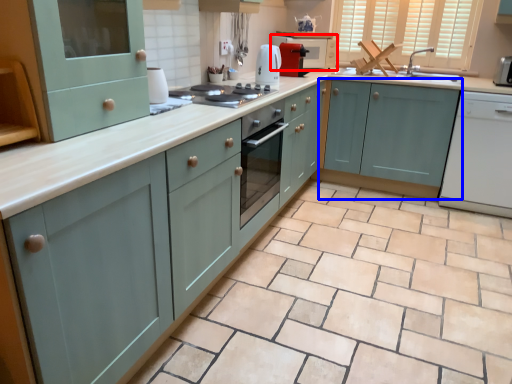
Question: Among these objects, which one is nearest to the camera, microwave (highlighted by a red box) or cabinetry (highlighted by a blue box)?

Choices:
 (A) microwave
 (B) cabinetry

Answer: (B)